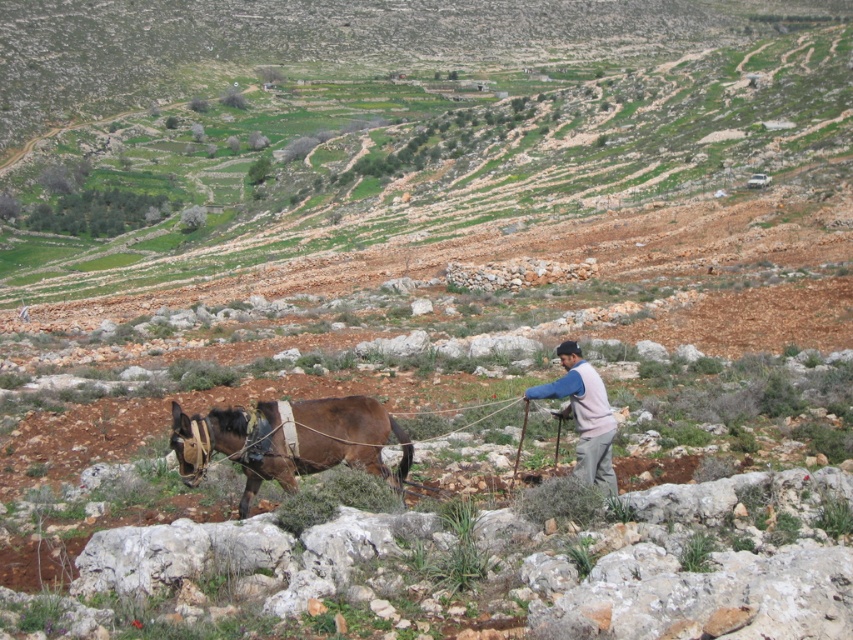
Question: Which point appears farthest from the camera in this image?

Choices:
 (A) (96, 113)
 (B) (567, 396)
 (C) (289, 451)

Answer: (A)

Question: Among these points, which one is farthest from the camera?

Choices:
 (A) (21, 99)
 (B) (383, 477)

Answer: (A)

Question: Can you confirm if brown soil at center is smaller than brown leather donkey at lower left?

Choices:
 (A) yes
 (B) no

Answer: (B)

Question: Can you confirm if brown soil at center is bigger than brown leather donkey at lower left?

Choices:
 (A) yes
 (B) no

Answer: (A)

Question: Which of the following is the farthest from the observer?

Choices:
 (A) light brown fabric at center
 (B) brown leather donkey at lower left

Answer: (A)

Question: Does brown leather donkey at lower left have a greater width compared to light brown fabric at center?

Choices:
 (A) no
 (B) yes

Answer: (B)